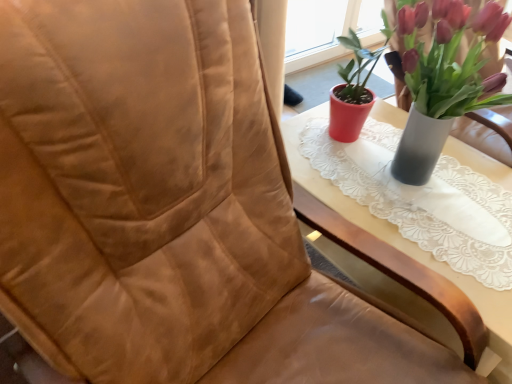
Question: Is wooden table at center thinner than matte red pot at upper right?

Choices:
 (A) yes
 (B) no

Answer: (B)

Question: Would you say matte red pot at upper right is part of wooden table at center's contents?

Choices:
 (A) yes
 (B) no

Answer: (B)

Question: Can you confirm if wooden table at center is smaller than matte red pot at upper right?

Choices:
 (A) no
 (B) yes

Answer: (A)

Question: Does wooden table at center come behind matte red pot at upper right?

Choices:
 (A) yes
 (B) no

Answer: (A)

Question: Considering the relative sizes of wooden table at center and matte red pot at upper right in the image provided, is wooden table at center wider than matte red pot at upper right?

Choices:
 (A) yes
 (B) no

Answer: (A)

Question: From the image's perspective, is wooden table at center over matte red pot at upper right?

Choices:
 (A) yes
 (B) no

Answer: (B)

Question: Can you confirm if matte red pot at upper right is thinner than wooden table at center?

Choices:
 (A) yes
 (B) no

Answer: (A)

Question: Is matte red pot at upper right to the right of wooden table at center from the viewer's perspective?

Choices:
 (A) no
 (B) yes

Answer: (B)

Question: Does matte red pot at upper right come in front of wooden table at center?

Choices:
 (A) no
 (B) yes

Answer: (B)

Question: Is matte red pot at upper right placed right next to wooden table at center?

Choices:
 (A) yes
 (B) no

Answer: (B)

Question: From the image's perspective, does matte red pot at upper right appear lower than wooden table at center?

Choices:
 (A) yes
 (B) no

Answer: (B)

Question: Is the position of matte red pot at upper right more distant than that of wooden table at center?

Choices:
 (A) no
 (B) yes

Answer: (A)

Question: From a real-world perspective, relative to matte red pot at upper right, is wooden table at center vertically above or below?

Choices:
 (A) below
 (B) above

Answer: (A)